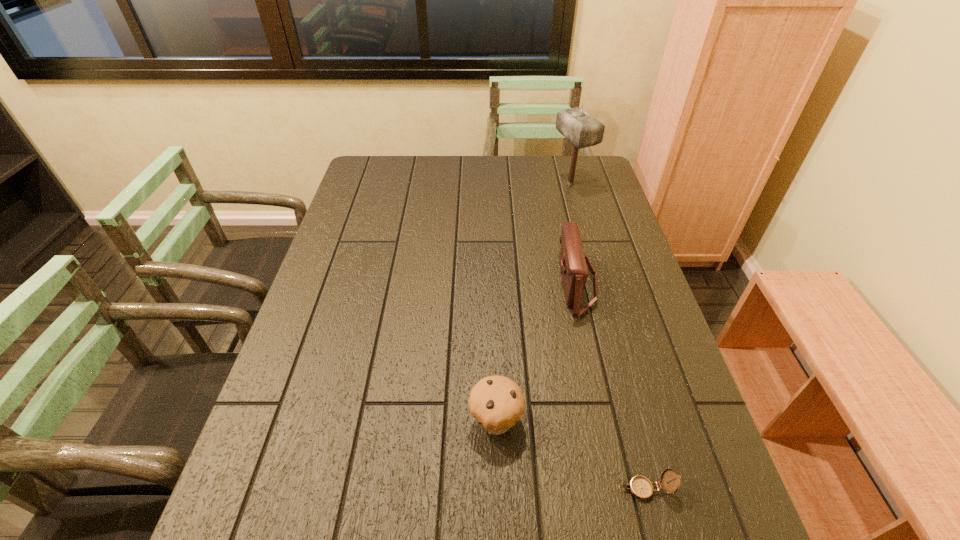
The height and width of the screenshot is (540, 960). What are the coordinates of `object situated at the far right corner` in the screenshot? It's located at (583, 130).

At what (x,y) coordinates should I click in order to perform the action: click on free space at the far edge of the desktop. Please return your answer as a coordinate pair (x, y). Looking at the image, I should click on (530, 181).

You are a GUI agent. You are given a task and a screenshot of the screen. Output one action in this format:
    pyautogui.click(x=<x>, y=<y>)
    Task: Click on the blank area at the left edge
    
    Given the screenshot: What is the action you would take?
    pyautogui.click(x=274, y=438)

Image resolution: width=960 pixels, height=540 pixels. Find the location of `free space at the right edge of the desktop`. free space at the right edge of the desktop is located at coordinates (x=583, y=212).

Locate an element on the screen. The width and height of the screenshot is (960, 540). vacant point at the far left corner is located at coordinates (378, 186).

Image resolution: width=960 pixels, height=540 pixels. I want to click on free spot between the shortest object and the leftmost object, so click(570, 455).

Locate an element on the screen. This screenshot has height=540, width=960. free space between the second nearest object and the shortest object is located at coordinates (570, 455).

What are the coordinates of `free space between the tallest object and the compass` in the screenshot? It's located at (608, 336).

In order to click on blank region between the third tallest object and the mallet in this screenshot , I will do `click(533, 302)`.

This screenshot has width=960, height=540. I want to click on free spot between the compass and the farthest object, so click(608, 336).